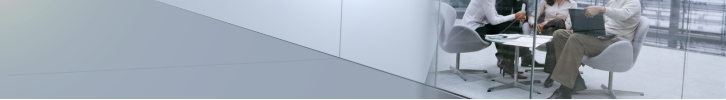
The width and height of the screenshot is (726, 100). I want to click on chairs, so click(x=616, y=56), click(x=526, y=27), click(x=462, y=39).